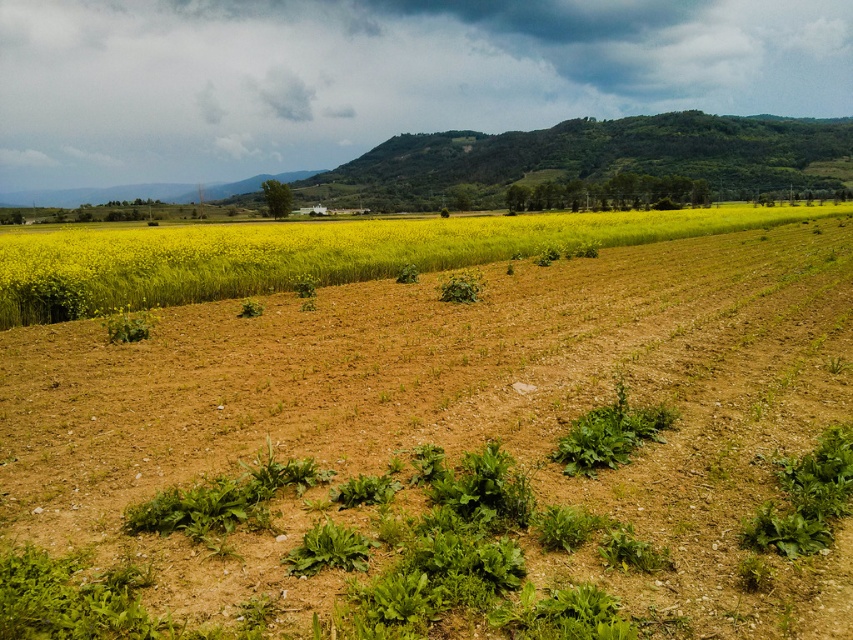
Question: Which is nearer to the brown soil at center?

Choices:
 (A) yellow grass at upper left
 (B) green leafy plant at center

Answer: (B)

Question: Which point is farther to the camera?

Choices:
 (A) brown soil at center
 (B) yellow grass at upper left

Answer: (B)

Question: Does brown soil at center appear on the left side of green leafy plant at center?

Choices:
 (A) yes
 (B) no

Answer: (B)

Question: Which point is farther from the camera taking this photo?

Choices:
 (A) (73, 330)
 (B) (622, 412)
 (C) (154, 244)

Answer: (C)

Question: Can you confirm if brown soil at center is smaller than yellow grass at upper left?

Choices:
 (A) yes
 (B) no

Answer: (A)

Question: Is brown soil at center below green leafy plant at center?

Choices:
 (A) yes
 (B) no

Answer: (B)